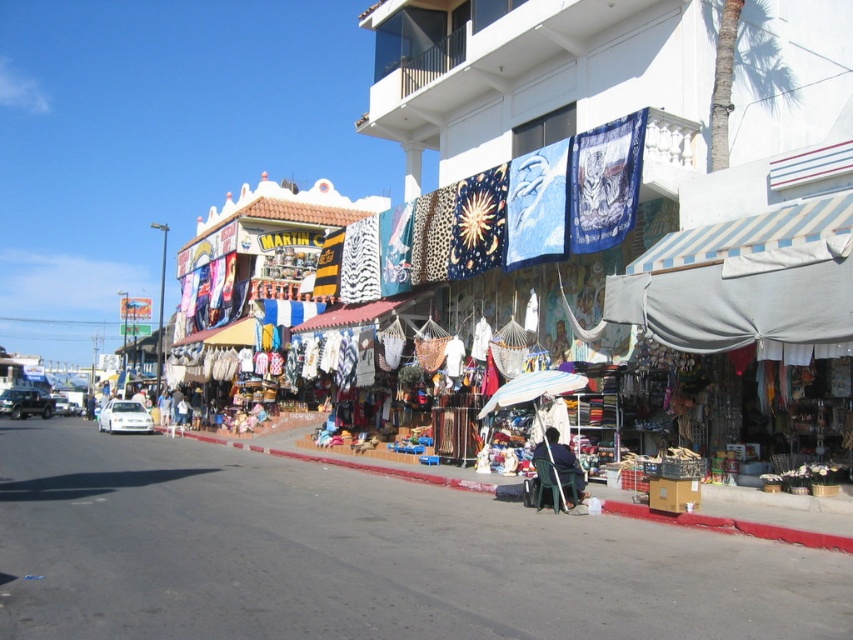
Question: Among these points, which one is nearest to the camera?

Choices:
 (A) (552, 458)
 (B) (541, 385)

Answer: (A)

Question: Does white fabric umbrella at center have a lesser width compared to dark blue fabric at center?

Choices:
 (A) no
 (B) yes

Answer: (A)

Question: Which of the following is the closest to the observer?

Choices:
 (A) (550, 445)
 (B) (558, 388)

Answer: (A)

Question: Which object is farther from the camera taking this photo?

Choices:
 (A) dark blue fabric at center
 (B) white fabric umbrella at center

Answer: (B)

Question: In this image, where is white fabric umbrella at center located relative to dark blue fabric at center?

Choices:
 (A) below
 (B) above

Answer: (B)

Question: Can you confirm if white fabric umbrella at center is bigger than dark blue fabric at center?

Choices:
 (A) yes
 (B) no

Answer: (A)